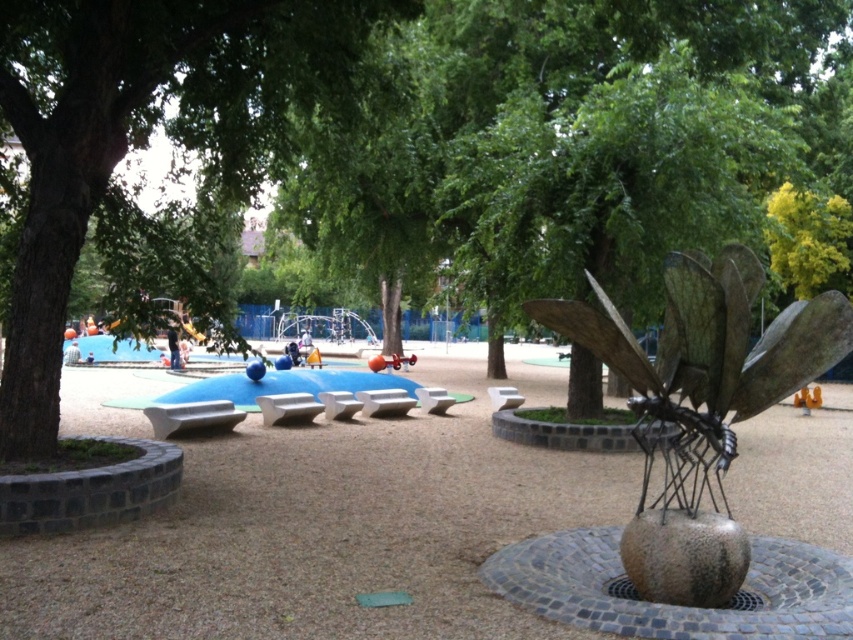
Question: Which point is farther from the camera taking this photo?

Choices:
 (A) (35, 10)
 (B) (640, 582)

Answer: (A)

Question: Can you confirm if green leafy tree at left is positioned below bronze metallic dragonfly at center?

Choices:
 (A) no
 (B) yes

Answer: (A)

Question: Is green leafy tree at left smaller than bronze metallic dragonfly at center?

Choices:
 (A) no
 (B) yes

Answer: (B)

Question: Is green leafy tree at left thinner than bronze metallic dragonfly at center?

Choices:
 (A) no
 (B) yes

Answer: (B)